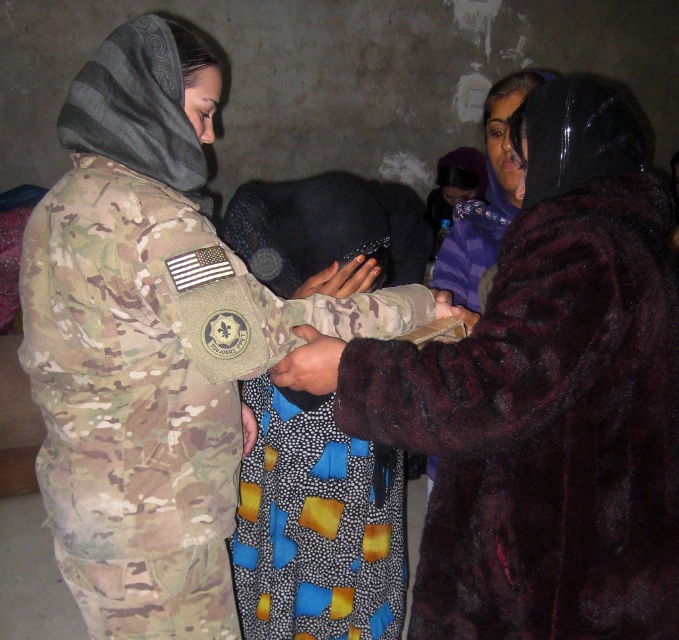
You are standing in the dimly lit indoor scene with a rough wall. You see the velvet maroon coat at right and the camouflage uniform at left. Which object is positioned to the right of the other?

The velvet maroon coat at right is to the right of the camouflage uniform at left.

You are a photographer setting up a shoot in a dimly lit indoor space with a rough wall backdrop. You have two subjects wearing the velvet maroon coat at right and camouflage uniform at left. Based on their height difference, which subject should stand closer to the camera to make them appear the same height in the photo?

The velvet maroon coat at right is not as tall as the camouflage uniform at left, so to make them appear the same height in the photo, the shorter subject in the velvet maroon coat at right should stand closer to the camera.

You are a photographer setting up a shoot in this dimly lit indoor space. You need to position a spotlight so that it illuminates both the velvet maroon coat at right and the smooth brown leather hand at center without casting harsh shadows. Given their distance apart, is this feasible?

The velvet maroon coat at right and smooth brown leather hand at center are 16.90 inches apart. Since they are relatively close, positioning a spotlight to illuminate both without harsh shadows is feasible by adjusting the angle and intensity appropriately.